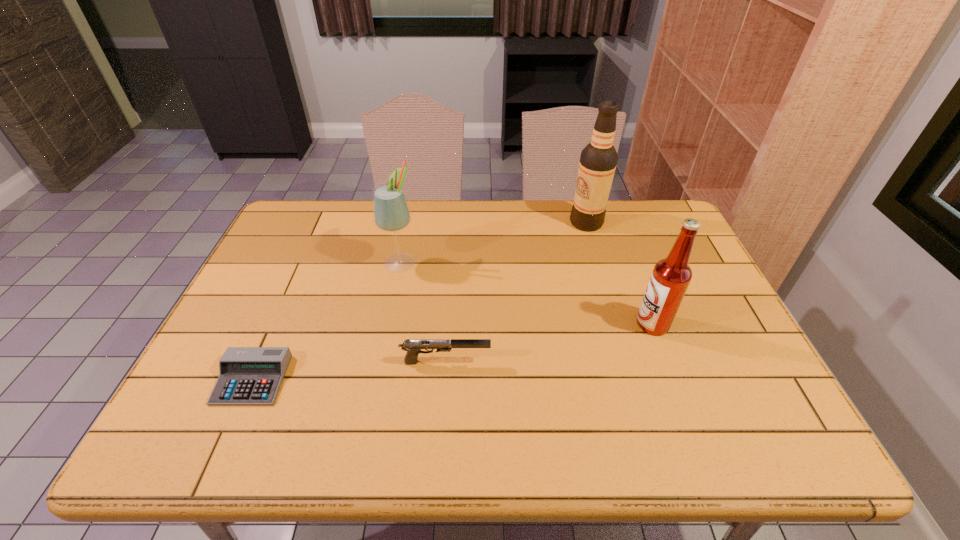
Where is `free space between the second shortest object and the farthest object`? free space between the second shortest object and the farthest object is located at coordinates (516, 292).

Where is `unoccupied area between the leftmost alcohol and the second shortest object`? This screenshot has width=960, height=540. unoccupied area between the leftmost alcohol and the second shortest object is located at coordinates (423, 312).

Locate an element on the screen. This screenshot has width=960, height=540. vacant area that lies between the tallest object and the leftmost alcohol is located at coordinates (493, 242).

Where is `empty location between the leftmost alcohol and the tallest object`? empty location between the leftmost alcohol and the tallest object is located at coordinates (493, 242).

Locate which object ranks fourth in proximity to the nearest alcohol. Please provide its 2D coordinates. Your answer should be formatted as a tuple, i.e. [(x, y)], where the tuple contains the x and y coordinates of a point satisfying the conditions above.

[(248, 376)]

Point out which object is positioned as the nearest to the second farthest object. Please provide its 2D coordinates. Your answer should be formatted as a tuple, i.e. [(x, y)], where the tuple contains the x and y coordinates of a point satisfying the conditions above.

[(413, 347)]

Choose which alcohol is the nearest neighbor to the third nearest object. Please provide its 2D coordinates. Your answer should be formatted as a tuple, i.e. [(x, y)], where the tuple contains the x and y coordinates of a point satisfying the conditions above.

[(598, 160)]

Point out which alcohol is positioned as the nearest to the tallest object. Please provide its 2D coordinates. Your answer should be formatted as a tuple, i.e. [(x, y)], where the tuple contains the x and y coordinates of a point satisfying the conditions above.

[(671, 276)]

Find the location of a particular element. The width and height of the screenshot is (960, 540). free space that satisfies the following two spatial constraints: 1. on the back side of the leftmost alcohol; 2. on the left side of the leftmost object is located at coordinates (304, 262).